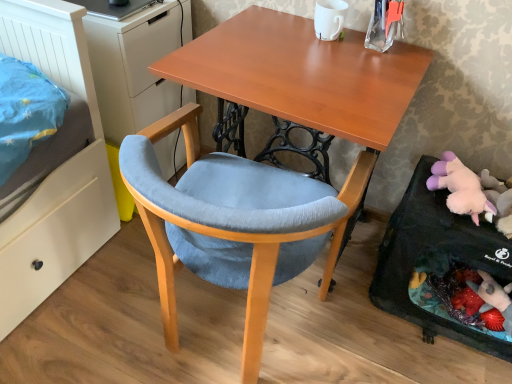
This screenshot has width=512, height=384. What are the coordinates of `free area in between wooden desk at center and fluffy pink stuffed animal at lower right` in the screenshot? It's located at (395, 326).